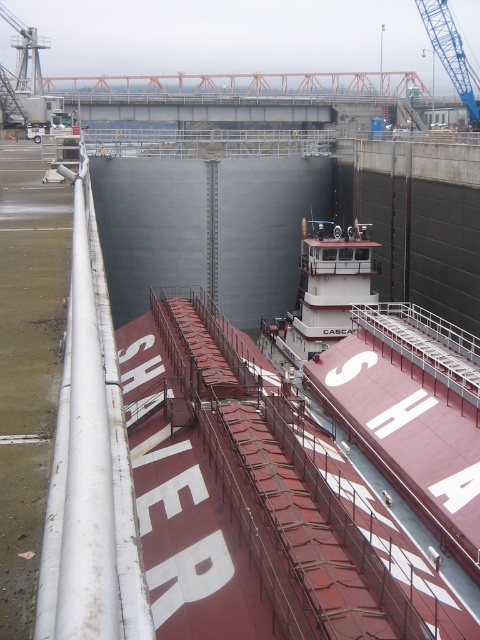
Question: Considering the relative positions of maroon matte barge at center and white matte tugboat at center in the image provided, where is maroon matte barge at center located with respect to white matte tugboat at center?

Choices:
 (A) above
 (B) below

Answer: (B)

Question: Is maroon matte barge at center to the left of white matte tugboat at center from the viewer's perspective?

Choices:
 (A) yes
 (B) no

Answer: (B)

Question: Which of the following is the closest to the observer?

Choices:
 (A) (280, 326)
 (B) (350, 296)

Answer: (B)

Question: Among these objects, which one is nearest to the camera?

Choices:
 (A) white matte tugboat at center
 (B) maroon matte barge at center

Answer: (B)

Question: Which point is closer to the camera?

Choices:
 (A) white matte tugboat at center
 (B) maroon matte barge at center

Answer: (B)

Question: Is maroon matte barge at center bigger than white matte tugboat at center?

Choices:
 (A) no
 (B) yes

Answer: (B)